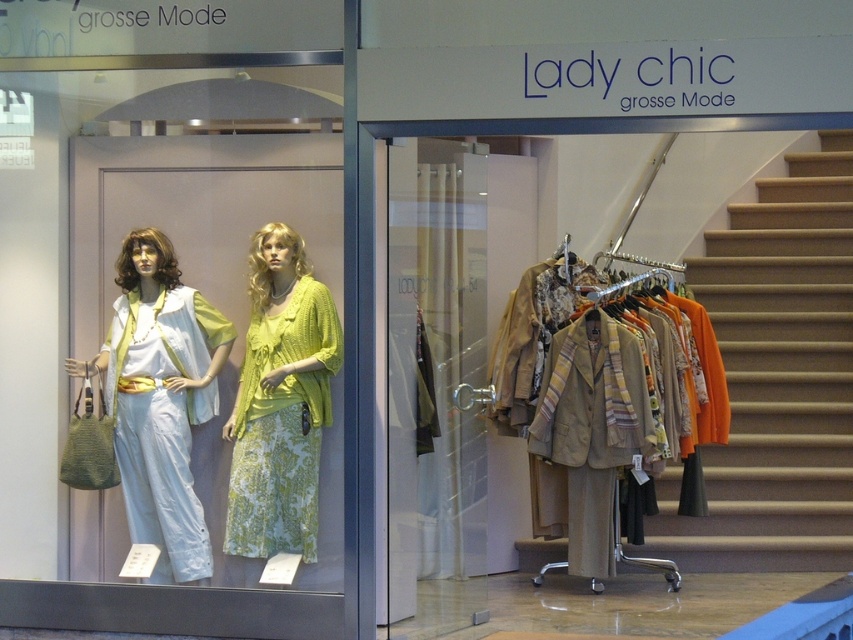
Where is `matte yellow dress at center`? The width and height of the screenshot is (853, 640). matte yellow dress at center is located at coordinates (198, 262).

Is point (320, 212) more distant than point (288, 541)?

Yes, it is behind point (288, 541).

Locate an element on the screen. The width and height of the screenshot is (853, 640). matte yellow dress at center is located at coordinates (198, 262).

Is matte green fabric dress at center above matte yellow knit cardigan at center?

Actually, matte green fabric dress at center is below matte yellow knit cardigan at center.

Is point (134, 317) more distant than point (287, 291)?

No, (134, 317) is closer to viewer.

Who is more distant from viewer, (148, 374) or (264, 253)?

Point (264, 253)

I want to click on matte green fabric dress at center, so click(160, 400).

Looking at this image, does matte yellow dress at center appear under beige fabric blazer at center?

Incorrect, matte yellow dress at center is not positioned below beige fabric blazer at center.

Between point (126, 541) and point (543, 474), which one is positioned in front?

Point (126, 541) is in front.

Image resolution: width=853 pixels, height=640 pixels. What are the coordinates of `matte yellow dress at center` in the screenshot? It's located at (198, 262).